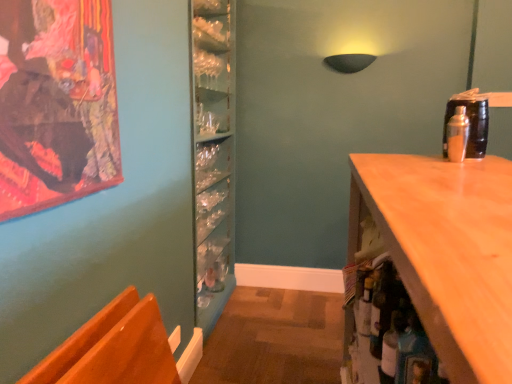
Question: Is metallic silver shaker at upper right, the second bottle in the front-to-back sequence, located outside shiny orange chair at lower left?

Choices:
 (A) yes
 (B) no

Answer: (A)

Question: From a real-world perspective, is metallic silver shaker at upper right, the second bottle in the front-to-back sequence, over shiny orange chair at lower left?

Choices:
 (A) yes
 (B) no

Answer: (A)

Question: From a real-world perspective, is metallic silver shaker at upper right, positioned as the 1th bottle in top-to-bottom order, located beneath shiny orange chair at lower left?

Choices:
 (A) yes
 (B) no

Answer: (B)

Question: Does metallic silver shaker at upper right, positioned as the 1th bottle in top-to-bottom order, lie in front of shiny orange chair at lower left?

Choices:
 (A) yes
 (B) no

Answer: (B)

Question: Is shiny orange chair at lower left inside metallic silver shaker at upper right, acting as the 1th bottle starting from the back?

Choices:
 (A) yes
 (B) no

Answer: (B)

Question: Relative to metallic silver shaker at upper right, acting as the 1th bottle starting from the back, is shiny orange chair at lower left in front or behind?

Choices:
 (A) front
 (B) behind

Answer: (A)

Question: From the image's perspective, is shiny orange chair at lower left located above or below metallic silver shaker at upper right, arranged as the second bottle when viewed from the left?

Choices:
 (A) below
 (B) above

Answer: (A)

Question: Is shiny orange chair at lower left inside the boundaries of metallic silver shaker at upper right, the second bottle in the front-to-back sequence, or outside?

Choices:
 (A) outside
 (B) inside

Answer: (A)

Question: In terms of size, does shiny orange chair at lower left appear bigger or smaller than metallic silver shaker at upper right, positioned as the 1th bottle in top-to-bottom order?

Choices:
 (A) big
 (B) small

Answer: (A)

Question: From the image's perspective, is translucent glass bottle at lower right, which ranks as the 2th bottle in top-to-bottom order, above or below shiny orange chair at lower left?

Choices:
 (A) above
 (B) below

Answer: (A)

Question: In the image, is translucent glass bottle at lower right, which is the first bottle from front to back, positioned in front of or behind shiny orange chair at lower left?

Choices:
 (A) front
 (B) behind

Answer: (B)

Question: Looking at their shapes, would you say translucent glass bottle at lower right, which is the first bottle from front to back, is wider or thinner than shiny orange chair at lower left?

Choices:
 (A) wide
 (B) thin

Answer: (B)

Question: In terms of size, does translucent glass bottle at lower right, which appears as the second bottle when viewed from the right, appear bigger or smaller than shiny orange chair at lower left?

Choices:
 (A) big
 (B) small

Answer: (B)

Question: From the image's perspective, is shiny orange chair at lower left positioned above or below translucent glass bottle at lower right, which appears as the 1th bottle when viewed from the left?

Choices:
 (A) above
 (B) below

Answer: (B)

Question: Is shiny orange chair at lower left wider or thinner than translucent glass bottle at lower right, which ranks as the 2th bottle in top-to-bottom order?

Choices:
 (A) wide
 (B) thin

Answer: (A)